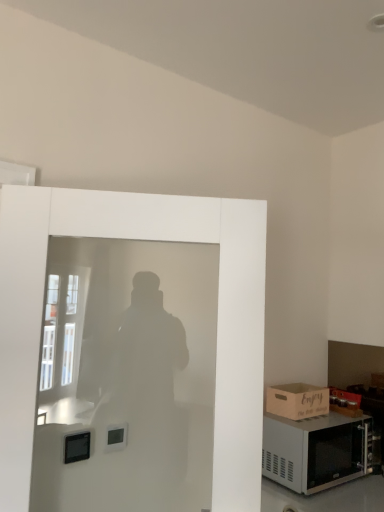
Question: Does point (322, 402) appear closer or farther from the camera than point (61, 414)?

Choices:
 (A) closer
 (B) farther

Answer: (B)

Question: Is brown cardboard box at lower right taller or shorter than white frosted glass screen door at left?

Choices:
 (A) tall
 (B) short

Answer: (B)

Question: Considering the real-world distances, which object is farthest from the satin silver microwave at lower right?

Choices:
 (A) white frosted glass screen door at left
 (B) brown cardboard box at lower right

Answer: (A)

Question: Which object is positioned farthest from the white frosted glass screen door at left?

Choices:
 (A) satin silver microwave at lower right
 (B) brown cardboard box at lower right

Answer: (B)